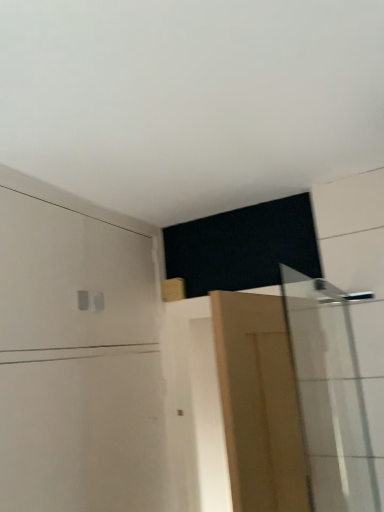
Question: Is white glossy shower door at right thinner than light brown wooden door at center?

Choices:
 (A) yes
 (B) no

Answer: (A)

Question: Is white glossy shower door at right oriented away from light brown wooden door at center?

Choices:
 (A) no
 (B) yes

Answer: (A)

Question: Does white glossy shower door at right have a smaller size compared to light brown wooden door at center?

Choices:
 (A) no
 (B) yes

Answer: (B)

Question: From the image's perspective, would you say white glossy shower door at right is positioned over light brown wooden door at center?

Choices:
 (A) yes
 (B) no

Answer: (A)

Question: Are white glossy shower door at right and light brown wooden door at center far apart?

Choices:
 (A) yes
 (B) no

Answer: (B)

Question: Is white glossy shower door at right to the left or to the right of light brown wooden door at center in the image?

Choices:
 (A) left
 (B) right

Answer: (B)

Question: In terms of width, does white glossy shower door at right look wider or thinner when compared to light brown wooden door at center?

Choices:
 (A) wide
 (B) thin

Answer: (B)

Question: From the image's perspective, is white glossy shower door at right located above or below light brown wooden door at center?

Choices:
 (A) above
 (B) below

Answer: (A)

Question: Considering the positions of point (340, 496) and point (235, 403), is point (340, 496) closer or farther from the camera than point (235, 403)?

Choices:
 (A) farther
 (B) closer

Answer: (A)

Question: Looking at the image, does light brown wooden door at center seem bigger or smaller compared to white glossy shower door at right?

Choices:
 (A) small
 (B) big

Answer: (B)

Question: Which is correct: light brown wooden door at center is inside white glossy shower door at right, or outside of it?

Choices:
 (A) outside
 (B) inside

Answer: (A)

Question: Is point (264, 480) closer or farther from the camera than point (327, 385)?

Choices:
 (A) farther
 (B) closer

Answer: (B)

Question: Is light brown wooden door at center in front of or behind white glossy shower door at right in the image?

Choices:
 (A) behind
 (B) front

Answer: (B)

Question: From the image's perspective, is white matte dresser at upper left above or below white glossy shower door at right?

Choices:
 (A) below
 (B) above

Answer: (A)

Question: Is point (109, 362) closer or farther from the camera than point (311, 504)?

Choices:
 (A) closer
 (B) farther

Answer: (B)